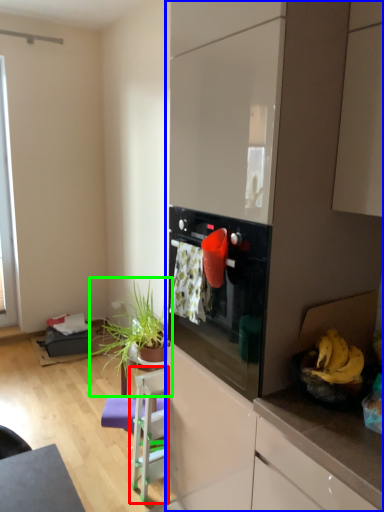
Question: Based on their relative distances, which object is farther from chair (highlighted by a red box)? Choose from dresser (highlighted by a blue box) and houseplant (highlighted by a green box).

Choices:
 (A) dresser
 (B) houseplant

Answer: (A)